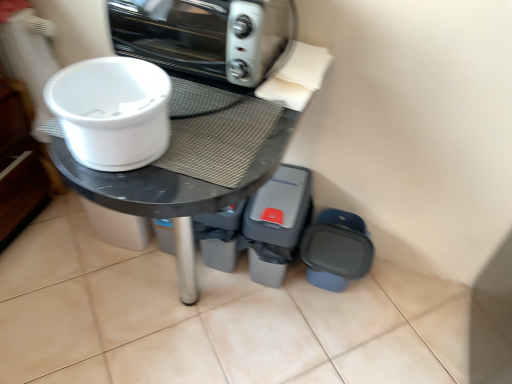
Question: In terms of width, does matte black table at center look wider or thinner when compared to gray plastic bin at lower right, the second appliance viewed from the right?

Choices:
 (A) wide
 (B) thin

Answer: (A)

Question: Looking at the image, does matte black table at center seem bigger or smaller compared to gray plastic bin at lower right, which appears as the first appliance when viewed from the left?

Choices:
 (A) big
 (B) small

Answer: (A)

Question: Considering the real-world distances, which object is closest to the matte plastic container at lower right, the first appliance from the right?

Choices:
 (A) white plastic bowl at upper left
 (B) gray plastic bin at lower right, which appears as the first appliance when viewed from the left
 (C) matte black table at center
 (D) metallic silver toaster oven at upper center

Answer: (B)

Question: Estimate the real-world distances between objects in this image. Which object is closer to the gray plastic bin at lower right, the second appliance viewed from the right?

Choices:
 (A) white plastic bowl at upper left
 (B) metallic silver toaster oven at upper center
 (C) matte black table at center
 (D) matte plastic container at lower right, the second appliance viewed from the left

Answer: (D)